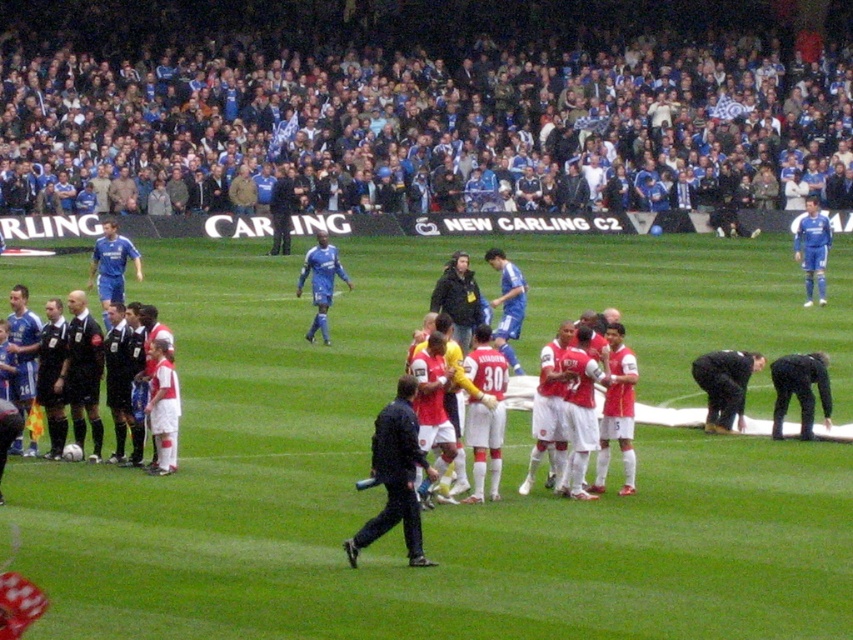
This screenshot has width=853, height=640. What do you see at coordinates (421, 106) in the screenshot?
I see `blue fabric at upper center` at bounding box center [421, 106].

In the scene shown: Is blue fabric at upper center positioned at the back of white jersey at left?

Yes, it is.

Between point (244, 212) and point (85, 365), which one is positioned in front?

Point (85, 365) is more forward.

The width and height of the screenshot is (853, 640). What are the coordinates of `blue fabric at upper center` in the screenshot? It's located at (421, 106).

Looking at this image, which is above, dark blue uniform at center or black leather jacket at lower right?

black leather jacket at lower right is higher up.

Is dark blue uniform at center below black leather jacket at lower right?

Yes, dark blue uniform at center is below black leather jacket at lower right.

This screenshot has height=640, width=853. Describe the element at coordinates (395, 476) in the screenshot. I see `dark blue uniform at center` at that location.

Locate an element on the screen. This screenshot has width=853, height=640. dark blue uniform at center is located at coordinates (395, 476).

Locate an element on the screen. The height and width of the screenshot is (640, 853). blue fabric at upper center is located at coordinates (421, 106).

Who is more forward, (102, 77) or (459, 333)?

Point (459, 333)

The width and height of the screenshot is (853, 640). I want to click on blue fabric at upper center, so coord(421,106).